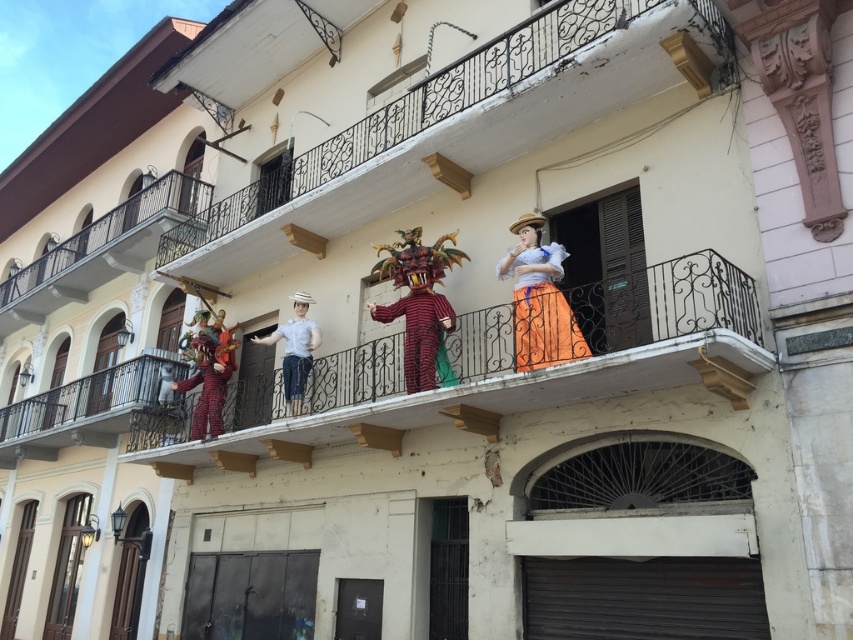
Question: Among these objects, which one is farthest from the camera?

Choices:
 (A) white wrought iron balcony at center
 (B) white wrought iron balcony at upper left
 (C) striped fabric dragon at center

Answer: (B)

Question: Does striped fabric dragon at center appear over white matte mannequin at center?

Choices:
 (A) yes
 (B) no

Answer: (A)

Question: Which point is farther to the camera?

Choices:
 (A) (152, 186)
 (B) (711, 42)
 (C) (527, 259)

Answer: (A)

Question: Which of the following is the farthest from the observer?

Choices:
 (A) (438, 380)
 (B) (289, 321)
 (C) (515, 314)
 (D) (136, 252)

Answer: (D)

Question: Is striped fabric dragon at center further to camera compared to white matte mannequin at center?

Choices:
 (A) yes
 (B) no

Answer: (B)

Question: Can you confirm if white wrought iron balcony at center is wider than orange satin dress at center?

Choices:
 (A) yes
 (B) no

Answer: (A)